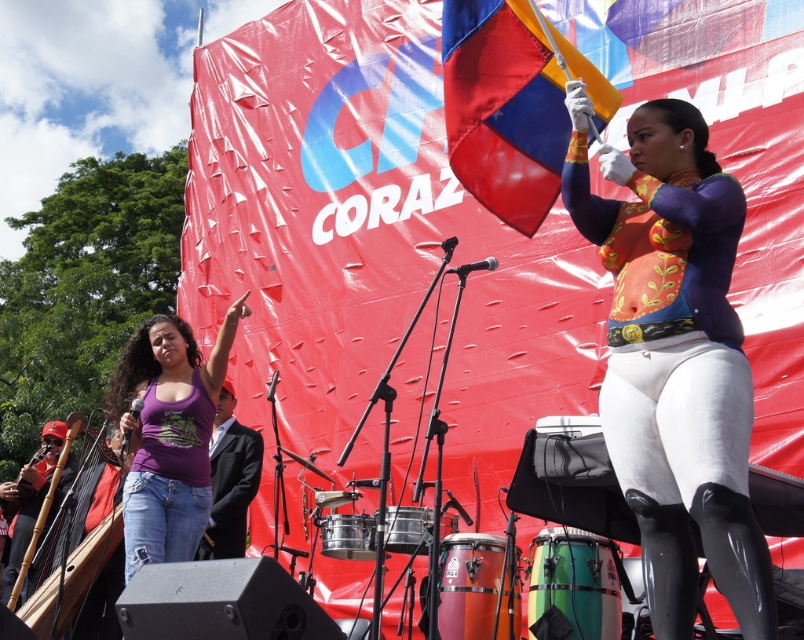
Does matte blue and orange vest at center have a larger size compared to purple cotton tank top at lower left?

No, matte blue and orange vest at center is not bigger than purple cotton tank top at lower left.

Is point (683, 161) in front of point (152, 442)?

Yes, it is in front of point (152, 442).

Locate an element on the screen. The height and width of the screenshot is (640, 804). matte blue and orange vest at center is located at coordinates (675, 358).

Does matte blue and orange vest at center have a lesser width compared to purple fabric shirt at left?

No, matte blue and orange vest at center is not thinner than purple fabric shirt at left.

Which is behind, point (643, 496) or point (255, 483)?

Point (255, 483)

This screenshot has width=804, height=640. I want to click on matte blue and orange vest at center, so click(x=675, y=358).

Locate an element on the screen. matte blue and orange vest at center is located at coordinates (675, 358).

Does matte blue and orange vest at center have a larger size compared to polyester flag at upper center?

Yes, matte blue and orange vest at center is bigger than polyester flag at upper center.

Find the location of a particular element. This screenshot has width=804, height=640. matte blue and orange vest at center is located at coordinates (675, 358).